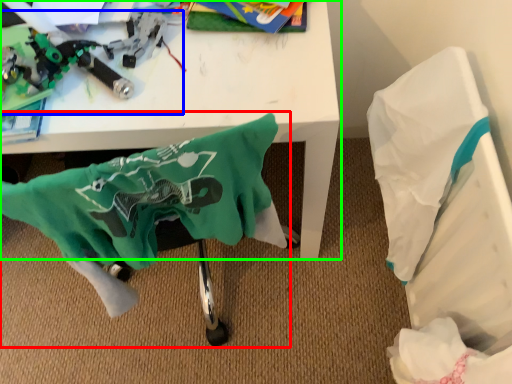
Question: Which object is positioned farthest from swivel chair (highlighted by a red box)? Select from toy (highlighted by a blue box) and table (highlighted by a green box).

Choices:
 (A) toy
 (B) table

Answer: (A)